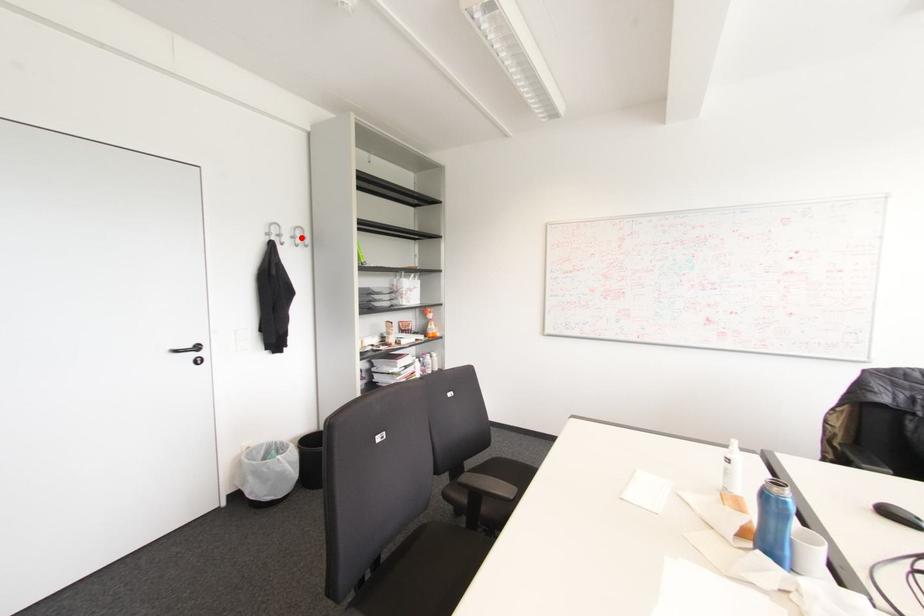
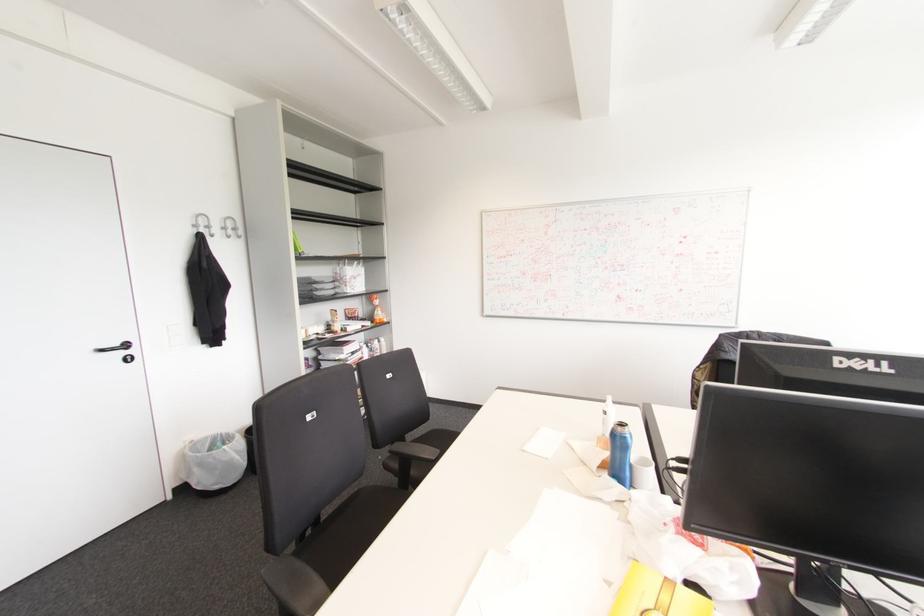
Find the pixel in the second image that matches the highlighted location in the first image.

(234, 229)